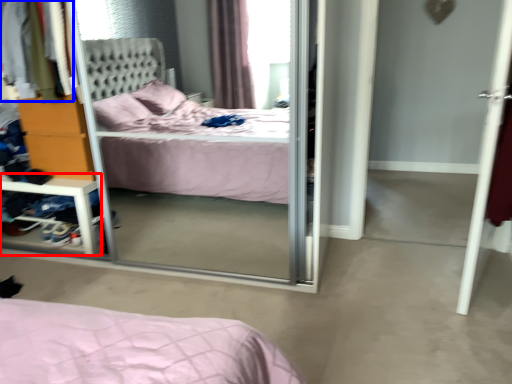
Question: Which object is further to the camera taking this photo, vanity (highlighted by a red box) or clothing (highlighted by a blue box)?

Choices:
 (A) vanity
 (B) clothing

Answer: (A)